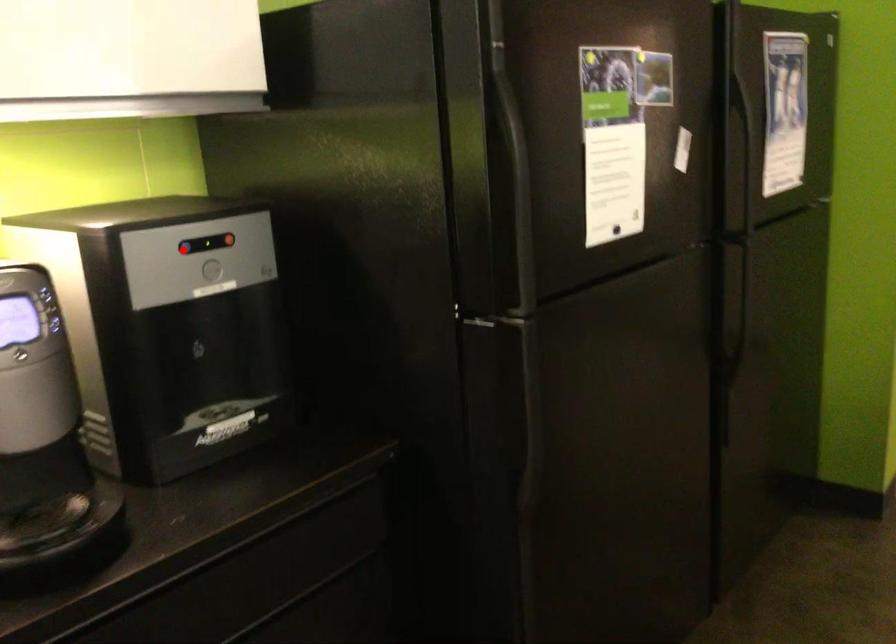
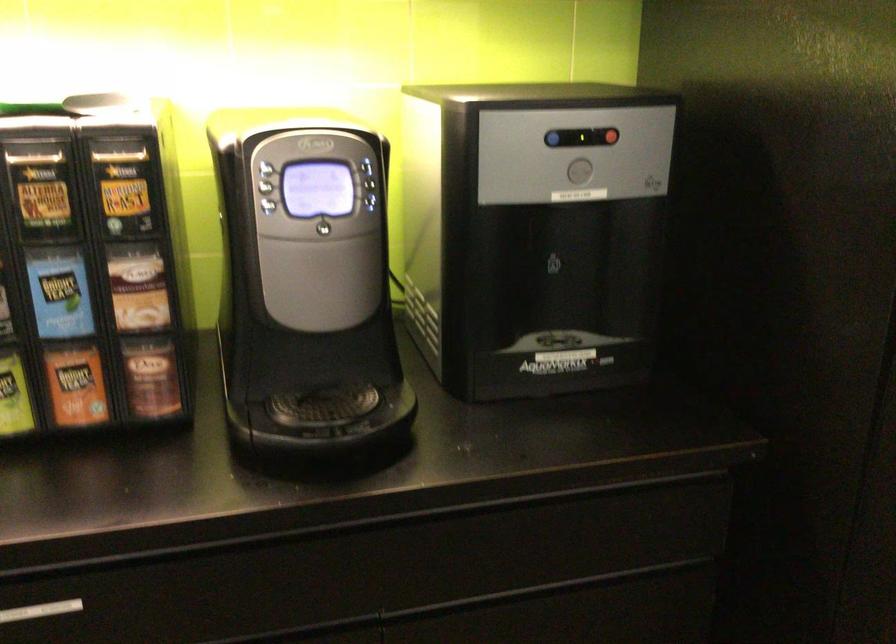
In the second image, find the point that corresponds to the highlighted location in the first image.

(552, 138)